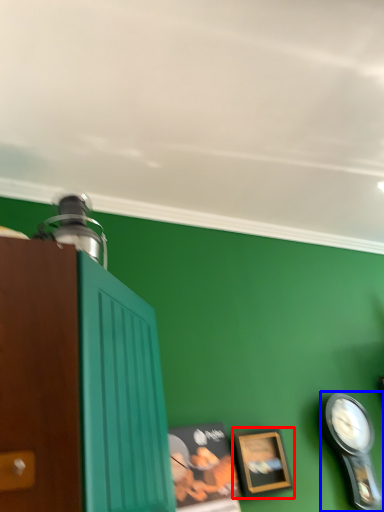
Question: Which point is closer to the camera, picture frame (highlighted by a red box) or clock (highlighted by a blue box)?

Choices:
 (A) picture frame
 (B) clock

Answer: (A)